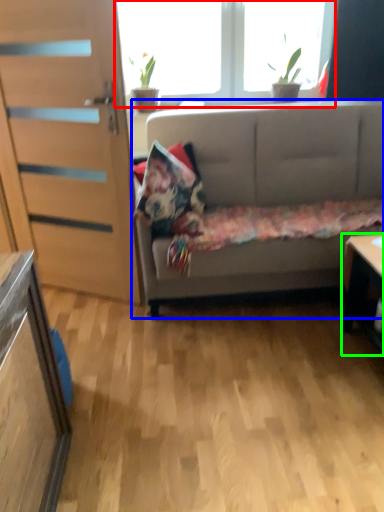
Question: Estimate the real-world distances between objects in this image. Which object is closer to window (highlighted by a red box), studio couch (highlighted by a blue box) or desk (highlighted by a green box)?

Choices:
 (A) studio couch
 (B) desk

Answer: (A)